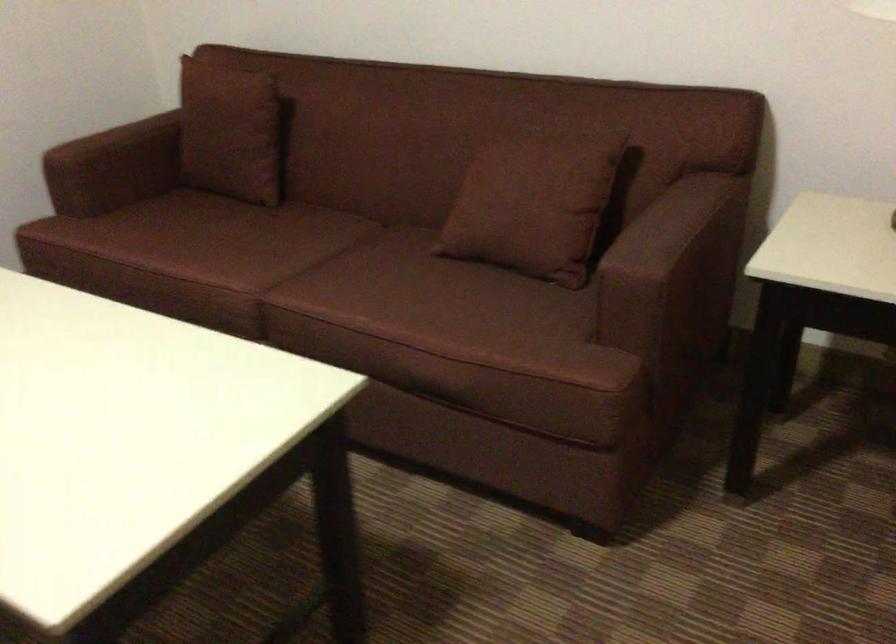
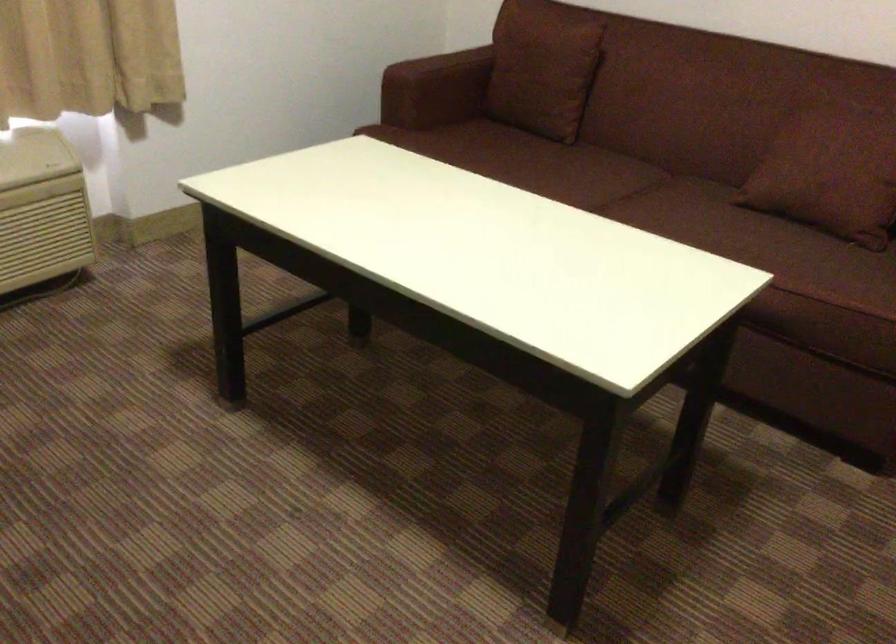
Locate, in the second image, the point that corresponds to point 261,251 in the first image.

(574, 176)